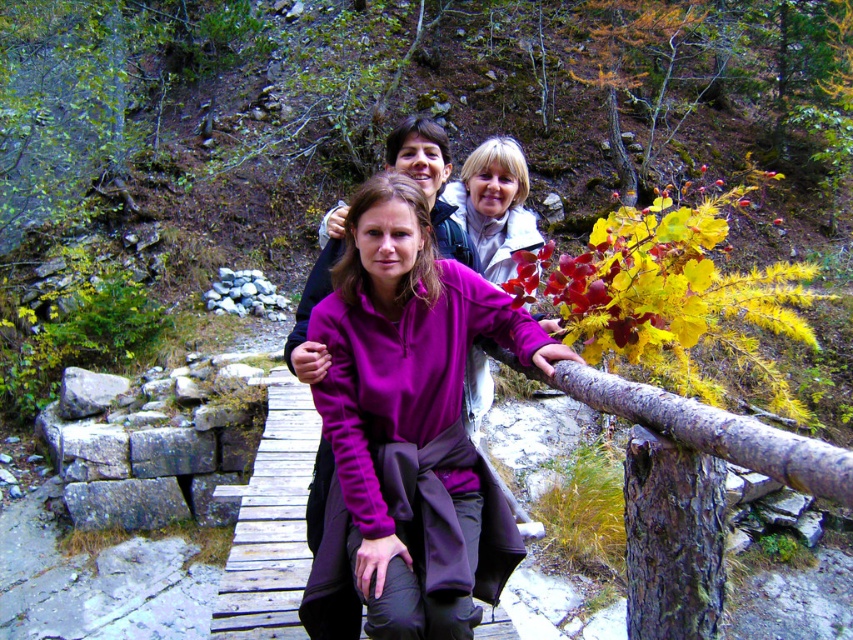
You are standing at the point marked as point [407,429] on the wooden bridge. What object is located exactly at that point?

The purple fleece jacket at center is located exactly at point [407,429] on the wooden bridge.

You are a photographer standing on the wooden bridge at center and want to take a photo of the purple fleece jacket at center. Since you are on the bridge, will you need to look up or down to frame the jacket properly?

The purple fleece jacket at center is much taller than the wooden bridge at center, so you will need to look up to frame the jacket properly.

You are a photographer standing on the wooden bridge at center. You want to take a photo of the purple fleece jacket at center. Which direction should you move to ensure the jacket fills more of the frame?

Since the purple fleece jacket at center has a lesser width compared to the wooden bridge at center, you should move closer to the purple fleece jacket at center to make it appear larger in the photo.